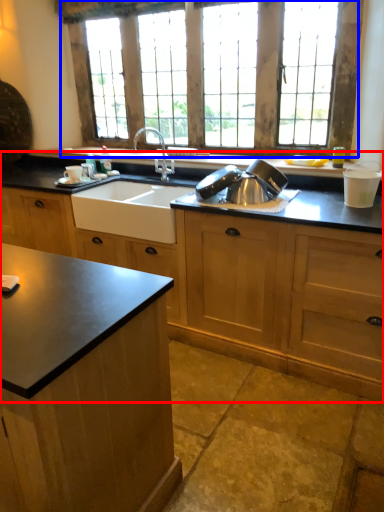
Question: Which of the following is the farthest to the observer, cabinetry (highlighted by a red box) or window (highlighted by a blue box)?

Choices:
 (A) cabinetry
 (B) window

Answer: (B)